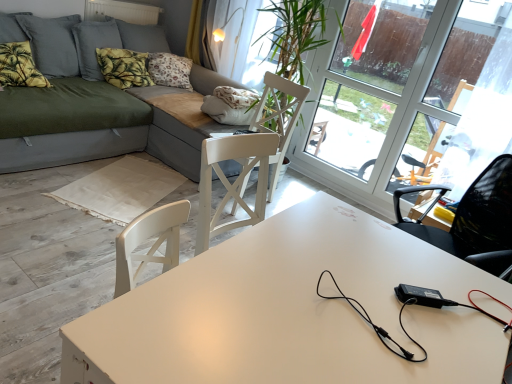
Question: Looking at the image, does transparent glass window at upper right seem bigger or smaller compared to yellow fabric curtain at upper center?

Choices:
 (A) big
 (B) small

Answer: (A)

Question: Is point (310, 153) positioned closer to the camera than point (199, 44)?

Choices:
 (A) farther
 (B) closer

Answer: (B)

Question: Considering the real-world distances, which object is farthest from the matte gray couch at center?

Choices:
 (A) white wood swivel chair at center
 (B) green leafy fabric pillow at upper left, which is the second pillow from left to right
 (C) white matte table at center
 (D) yellow fabric curtain at upper center
 (E) transparent glass window at upper right

Answer: (C)

Question: Estimate the real-world distances between objects in this image. Which object is farther from the yellow-green fabric pillow at upper left, the 1th pillow from the left?

Choices:
 (A) white matte table at center
 (B) transparent glass window at upper right
 (C) white wood swivel chair at center
 (D) yellow fabric curtain at upper center
 (E) green leafy fabric pillow at upper left, the first pillow when ordered from right to left

Answer: (A)